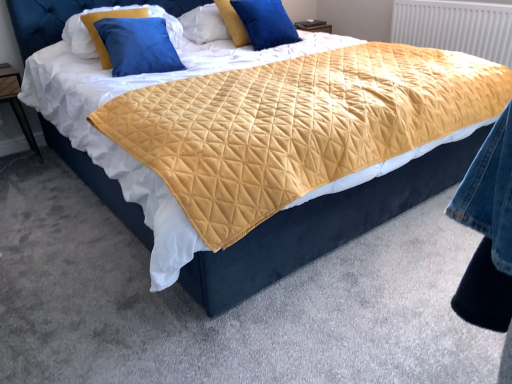
Question: Choose the correct answer: Is yellow quilted pillow at upper center, the first pillow from the right, inside wooden nightstand at left or outside it?

Choices:
 (A) inside
 (B) outside

Answer: (B)

Question: Considering the positions of yellow quilted pillow at upper center, which ranks as the 2th pillow in left-to-right order, and wooden nightstand at left in the image, is yellow quilted pillow at upper center, which ranks as the 2th pillow in left-to-right order, bigger or smaller than wooden nightstand at left?

Choices:
 (A) big
 (B) small

Answer: (B)

Question: Considering the real-world distances, which object is farthest from the yellow quilted pillow at upper center, which ranks as the 2th pillow in left-to-right order?

Choices:
 (A) yellow quilted radiator at upper right
 (B) wooden nightstand at left
 (C) blue velvet pillow at upper left, marked as the second pillow in a right-to-left arrangement

Answer: (B)

Question: Considering the real-world distances, which object is closest to the blue velvet pillow at upper left, marked as the second pillow in a right-to-left arrangement?

Choices:
 (A) yellow quilted radiator at upper right
 (B) wooden nightstand at left
 (C) yellow quilted pillow at upper center, the first pillow from the right

Answer: (C)